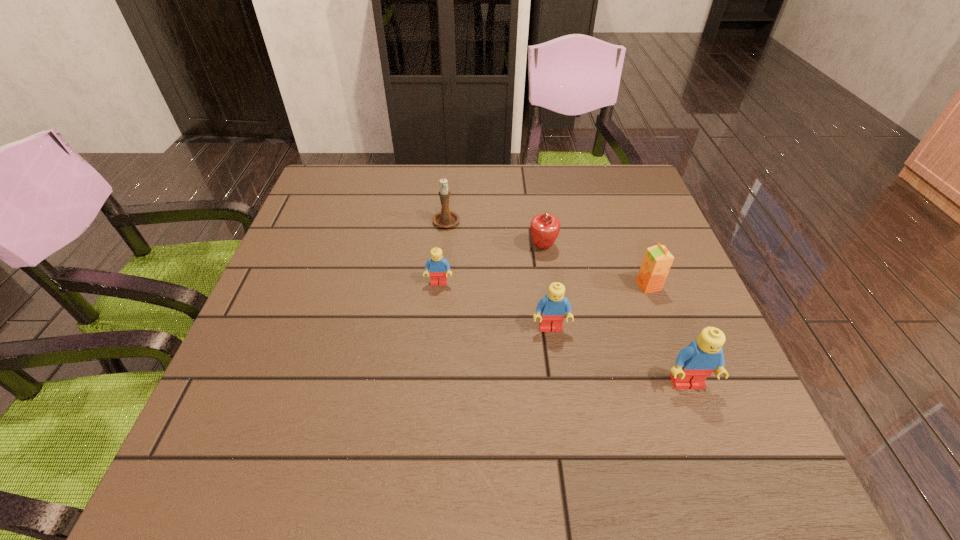
You are a GUI agent. You are given a task and a screenshot of the screen. Output one action in this format:
    pyautogui.click(x=<x>, y=<y>)
    Task: Click on the vacant space located on the face of the second nearest Lego
    This screenshot has height=540, width=960.
    Given the screenshot: What is the action you would take?
    561,397

Where is `vacant space located 0.290m on the left of the second farthest object`? This screenshot has height=540, width=960. vacant space located 0.290m on the left of the second farthest object is located at coordinates click(x=412, y=246).

I want to click on vacant space located 0.110m on the front of the orange juice, so click(x=666, y=333).

Where is `vacant area situated on the side of the farthest object with the handle`? vacant area situated on the side of the farthest object with the handle is located at coordinates (450, 179).

Identify the location of free location located 0.120m on the side of the farthest object with the handle. This screenshot has height=540, width=960. (449, 185).

Where is `vacant space situated on the side of the farthest object with the handle`? vacant space situated on the side of the farthest object with the handle is located at coordinates (449, 187).

At what (x,y) coordinates should I click in order to perform the action: click on object located at the far edge. Please return your answer as a coordinate pair (x, y). The image size is (960, 540). Looking at the image, I should click on (446, 218).

Locate an element on the screen. This screenshot has height=540, width=960. object located at the near edge is located at coordinates (694, 363).

Locate an element on the screen. The height and width of the screenshot is (540, 960). Lego present at the right edge is located at coordinates (694, 363).

Image resolution: width=960 pixels, height=540 pixels. I want to click on orange juice positioned at the right edge, so click(657, 261).